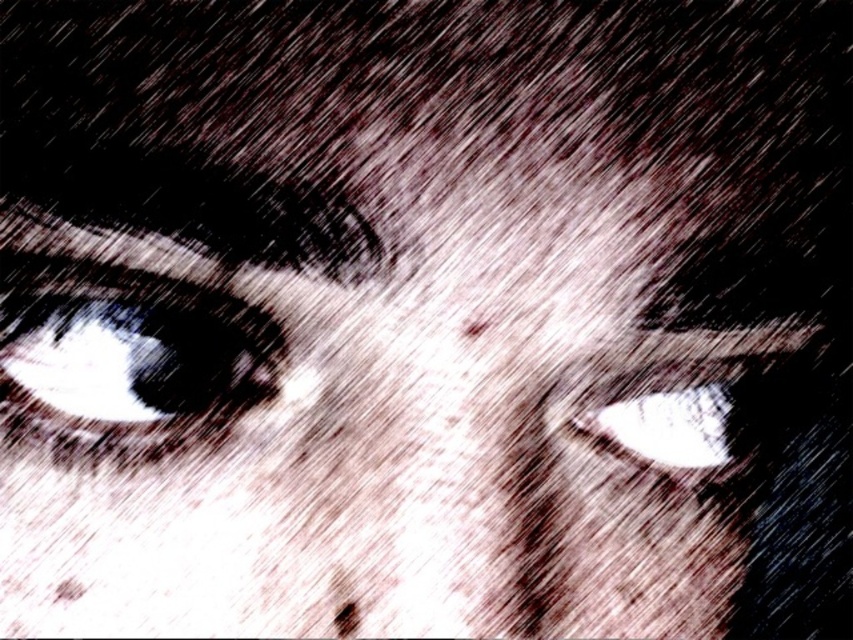
Question: Which of the following is the farthest from the observer?

Choices:
 (A) (96, 356)
 (B) (688, 374)

Answer: (B)

Question: Does shiny black eye at left appear on the left side of white glossy eye at center?

Choices:
 (A) no
 (B) yes

Answer: (B)

Question: Which point is farther from the camera taking this photo?

Choices:
 (A) (107, 422)
 (B) (625, 413)

Answer: (B)

Question: Can you confirm if shiny black eye at left is thinner than white glossy eye at center?

Choices:
 (A) no
 (B) yes

Answer: (A)

Question: Does shiny black eye at left lie in front of white glossy eye at center?

Choices:
 (A) yes
 (B) no

Answer: (A)